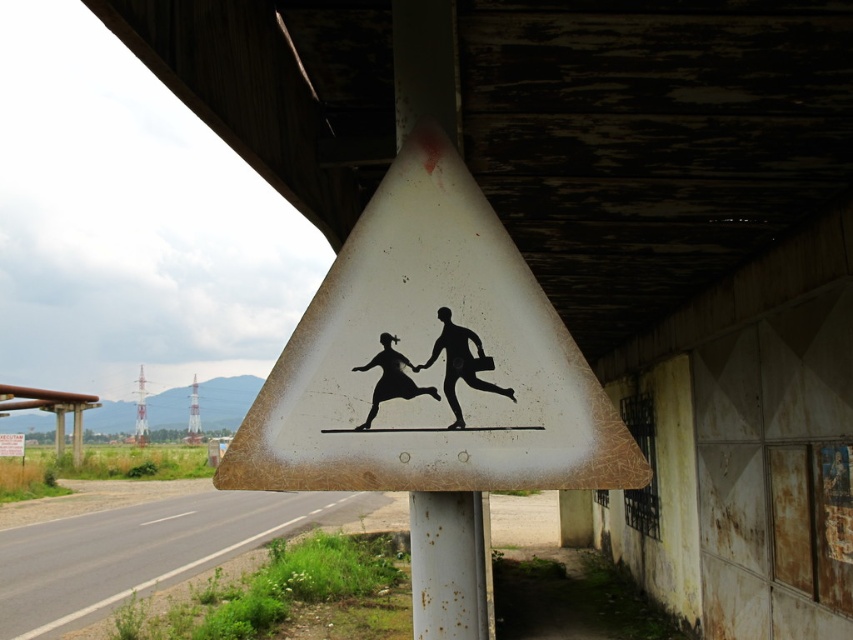
Identify the location of white matte sign at center. (430, 360).

The height and width of the screenshot is (640, 853). What do you see at coordinates (430, 360) in the screenshot?
I see `white matte sign at center` at bounding box center [430, 360].

This screenshot has height=640, width=853. What are the coordinates of `white matte sign at center` in the screenshot? It's located at click(430, 360).

Does asphalt road at lower left appear on the right side of rusty metal pole at center?

Incorrect, asphalt road at lower left is not on the right side of rusty metal pole at center.

Is asphalt road at lower left closer to camera compared to rusty metal pole at center?

Yes, it is.

Who is more forward, (x=0, y=598) or (x=476, y=513)?

Point (x=476, y=513) is more forward.

I want to click on asphalt road at lower left, so click(142, 550).

Is rusty metal pole at center bigger than black matte figure at center?

Indeed, rusty metal pole at center has a larger size compared to black matte figure at center.

Does point (422, 522) come behind point (451, 348)?

That is True.

Is point (476, 588) more distant than point (439, 353)?

That is True.

The image size is (853, 640). Identify the location of rusty metal pole at center. (450, 564).